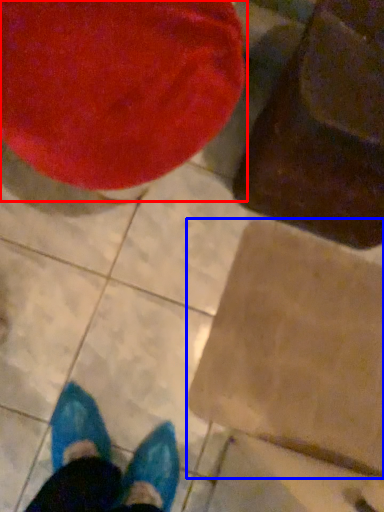
Question: Which point is further to the camera, bean bag chair (highlighted by a red box) or cardboard box (highlighted by a blue box)?

Choices:
 (A) bean bag chair
 (B) cardboard box

Answer: (B)